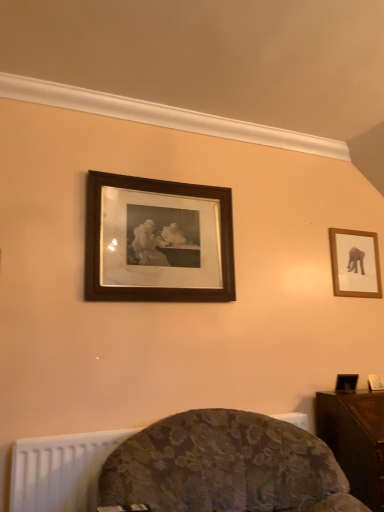
Question: In which direction should I rotate to look at black wood picture frame at upper center, the second picture frame when ordered from right to left?

Choices:
 (A) left
 (B) right

Answer: (A)

Question: Is black wood picture frame at upper center, arranged as the 2th picture frame when viewed from the back, not inside wooden frame at upper right, the 1th picture frame when ordered from right to left?

Choices:
 (A) no
 (B) yes

Answer: (B)

Question: Does black wood picture frame at upper center, the 1th picture frame positioned from the left, lie in front of wooden frame at upper right, which is the first picture frame from back to front?

Choices:
 (A) no
 (B) yes

Answer: (B)

Question: Can you confirm if black wood picture frame at upper center, arranged as the 2th picture frame when viewed from the back, is smaller than wooden frame at upper right, the second picture frame viewed from the front?

Choices:
 (A) no
 (B) yes

Answer: (A)

Question: Considering the relative sizes of black wood picture frame at upper center, the second picture frame when ordered from right to left, and wooden frame at upper right, the 1th picture frame when ordered from right to left, in the image provided, is black wood picture frame at upper center, the second picture frame when ordered from right to left, thinner than wooden frame at upper right, the 1th picture frame when ordered from right to left,?

Choices:
 (A) yes
 (B) no

Answer: (B)

Question: Is black wood picture frame at upper center, the second picture frame when ordered from right to left, facing towards wooden frame at upper right, which is the first picture frame from back to front?

Choices:
 (A) no
 (B) yes

Answer: (A)

Question: Considering the relative sizes of black wood picture frame at upper center, the second picture frame when ordered from right to left, and wooden frame at upper right, which is the first picture frame from back to front, in the image provided, is black wood picture frame at upper center, the second picture frame when ordered from right to left, shorter than wooden frame at upper right, which is the first picture frame from back to front,?

Choices:
 (A) yes
 (B) no

Answer: (B)

Question: Is wooden frame at upper right, the second picture frame viewed from the front, at the left side of dark wood table at lower right?

Choices:
 (A) yes
 (B) no

Answer: (B)

Question: Is wooden frame at upper right, the second picture frame viewed from the front, outside dark wood table at lower right?

Choices:
 (A) yes
 (B) no

Answer: (A)

Question: From the image's perspective, is wooden frame at upper right, which is the first picture frame from back to front, located beneath dark wood table at lower right?

Choices:
 (A) yes
 (B) no

Answer: (B)

Question: Is wooden frame at upper right, the 1th picture frame when ordered from right to left, next to dark wood table at lower right?

Choices:
 (A) yes
 (B) no

Answer: (B)

Question: Is wooden frame at upper right, the 2th picture frame when ordered from left to right, positioned with its back to dark wood table at lower right?

Choices:
 (A) no
 (B) yes

Answer: (A)

Question: From the image's perspective, is wooden frame at upper right, which is the first picture frame from back to front, on dark wood table at lower right?

Choices:
 (A) no
 (B) yes

Answer: (B)

Question: Is there a large distance between velvet floral chair at lower center and wooden frame at upper right, the second picture frame viewed from the front?

Choices:
 (A) no
 (B) yes

Answer: (B)